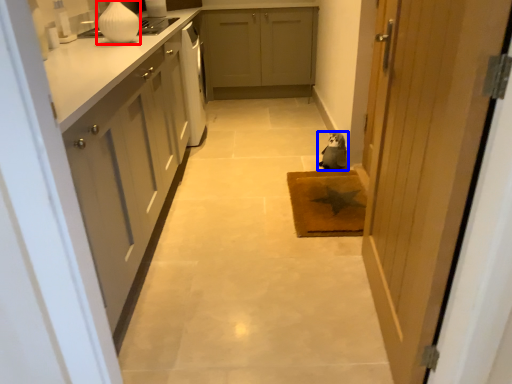
Question: Which point is further to the camera, vase (highlighted by a red box) or animal (highlighted by a blue box)?

Choices:
 (A) vase
 (B) animal

Answer: (B)